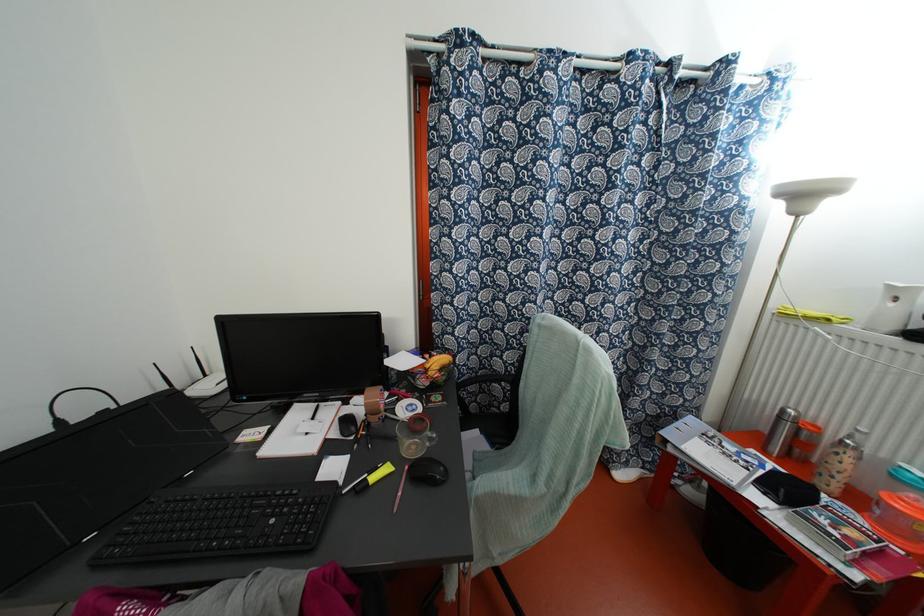
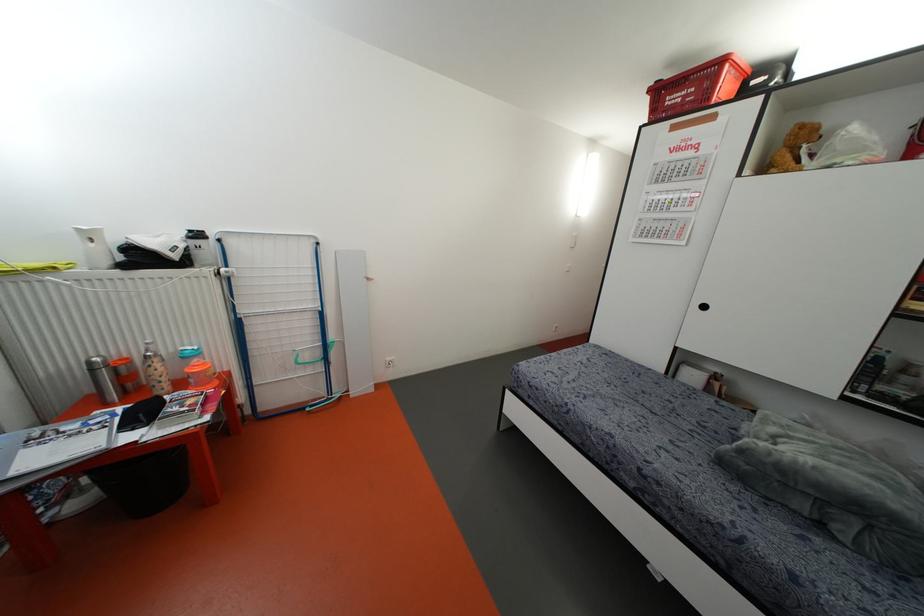
The first image is from the beginning of the video and the second image is from the end. How did the camera likely rotate when shooting the video?

The camera rotated toward right-down.